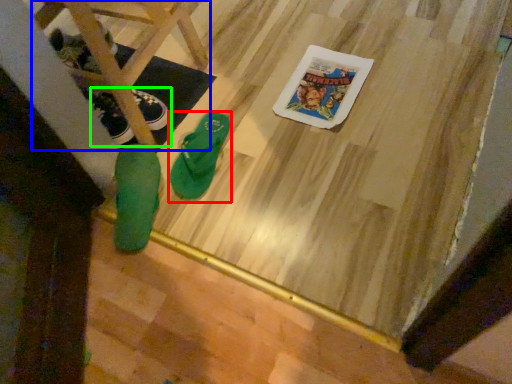
Question: Which is nearer to the footwear (highlighted by a red box)? furniture (highlighted by a blue box) or footwear (highlighted by a green box).

Choices:
 (A) furniture
 (B) footwear

Answer: (B)